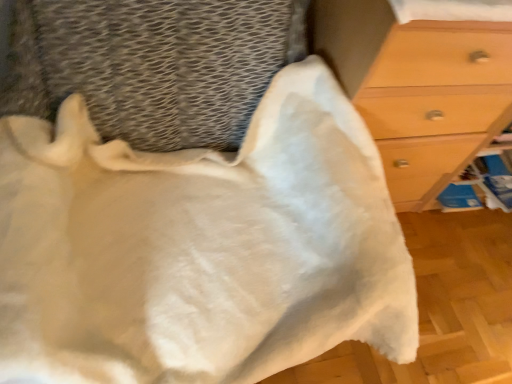
What do you see at coordinates (418, 88) in the screenshot?
I see `matte wood chest of drawers at right` at bounding box center [418, 88].

At what (x,y) coordinates should I click in order to perform the action: click on matte wood chest of drawers at right. Please return your answer as a coordinate pair (x, y). Looking at the image, I should click on (418, 88).

What do you see at coordinates (200, 246) in the screenshot? This screenshot has height=384, width=512. I see `white fluffy blanket at upper center` at bounding box center [200, 246].

At what (x,y) coordinates should I click in order to perform the action: click on white fluffy blanket at upper center. Please return your answer as a coordinate pair (x, y). Looking at the image, I should click on (200, 246).

Where is `matte wood chest of drawers at right`? Image resolution: width=512 pixels, height=384 pixels. matte wood chest of drawers at right is located at coordinates (418, 88).

Can you confirm if white fluffy blanket at upper center is positioned to the left of matte wood chest of drawers at right?

Correct, you'll find white fluffy blanket at upper center to the left of matte wood chest of drawers at right.

Which object is closer to the camera, white fluffy blanket at upper center or matte wood chest of drawers at right?

white fluffy blanket at upper center is in front.

Is point (159, 219) more distant than point (505, 28)?

Yes, it is behind point (505, 28).

From the image's perspective, is white fluffy blanket at upper center on matte wood chest of drawers at right?

No, from the image's perspective, white fluffy blanket at upper center is not above matte wood chest of drawers at right.

From a real-world perspective, is white fluffy blanket at upper center physically above matte wood chest of drawers at right?

Yes.

Can you confirm if white fluffy blanket at upper center is wider than matte wood chest of drawers at right?

Indeed, white fluffy blanket at upper center has a greater width compared to matte wood chest of drawers at right.

Does white fluffy blanket at upper center have a lesser height compared to matte wood chest of drawers at right?

Yes.

Considering the relative sizes of white fluffy blanket at upper center and matte wood chest of drawers at right in the image provided, is white fluffy blanket at upper center bigger than matte wood chest of drawers at right?

Actually, white fluffy blanket at upper center might be smaller than matte wood chest of drawers at right.

Is white fluffy blanket at upper center not inside matte wood chest of drawers at right?

Indeed, white fluffy blanket at upper center is completely outside matte wood chest of drawers at right.

Is white fluffy blanket at upper center positioned far away from matte wood chest of drawers at right?

No, there isn't a large distance between white fluffy blanket at upper center and matte wood chest of drawers at right.

Is white fluffy blanket at upper center oriented towards matte wood chest of drawers at right?

No, white fluffy blanket at upper center is not facing towards matte wood chest of drawers at right.

Can you tell me how much white fluffy blanket at upper center and matte wood chest of drawers at right differ in facing direction?

There is a 0.538-degree angle between the facing directions of white fluffy blanket at upper center and matte wood chest of drawers at right.

The height and width of the screenshot is (384, 512). I want to click on chest of drawers on the right of white fluffy blanket at upper center, so click(418, 88).

Is matte wood chest of drawers at right to the left of white fluffy blanket at upper center from the viewer's perspective?

No, matte wood chest of drawers at right is not to the left of white fluffy blanket at upper center.

Relative to white fluffy blanket at upper center, is matte wood chest of drawers at right in front or behind?

matte wood chest of drawers at right is positioned farther from the viewer than white fluffy blanket at upper center.

Which is in front, point (503, 81) or point (273, 85)?

The point (273, 85) is closer to the camera.

From the image's perspective, does matte wood chest of drawers at right appear higher than white fluffy blanket at upper center?

Yes.

From a real-world perspective, which is physically below, matte wood chest of drawers at right or white fluffy blanket at upper center?

matte wood chest of drawers at right.

Considering the sizes of objects matte wood chest of drawers at right and white fluffy blanket at upper center in the image provided, who is thinner, matte wood chest of drawers at right or white fluffy blanket at upper center?

matte wood chest of drawers at right.

Is matte wood chest of drawers at right shorter than white fluffy blanket at upper center?

No.

Based on the photo, which of these two, matte wood chest of drawers at right or white fluffy blanket at upper center, is smaller?

Smaller between the two is white fluffy blanket at upper center.

Is white fluffy blanket at upper center inside matte wood chest of drawers at right?

That's incorrect, white fluffy blanket at upper center is not inside matte wood chest of drawers at right.

Is there a large distance between matte wood chest of drawers at right and white fluffy blanket at upper center?

No, matte wood chest of drawers at right is not far from white fluffy blanket at upper center.

Does matte wood chest of drawers at right turn towards white fluffy blanket at upper center?

No, matte wood chest of drawers at right is not turned towards white fluffy blanket at upper center.

Can you tell me how much matte wood chest of drawers at right and white fluffy blanket at upper center differ in facing direction?

matte wood chest of drawers at right and white fluffy blanket at upper center are facing 0.538 degrees away from each other.

Identify the location of chest of drawers on the right of white fluffy blanket at upper center. (418, 88).

Find the location of a particular element. Image resolution: width=512 pixels, height=384 pixels. chest of drawers behind the white fluffy blanket at upper center is located at coordinates (418, 88).

You are a GUI agent. You are given a task and a screenshot of the screen. Output one action in this format:
    pyautogui.click(x=<x>, y=<y>)
    Task: Click on the chest of drawers on the right of white fluffy blanket at upper center
    
    Given the screenshot: What is the action you would take?
    pyautogui.click(x=418, y=88)